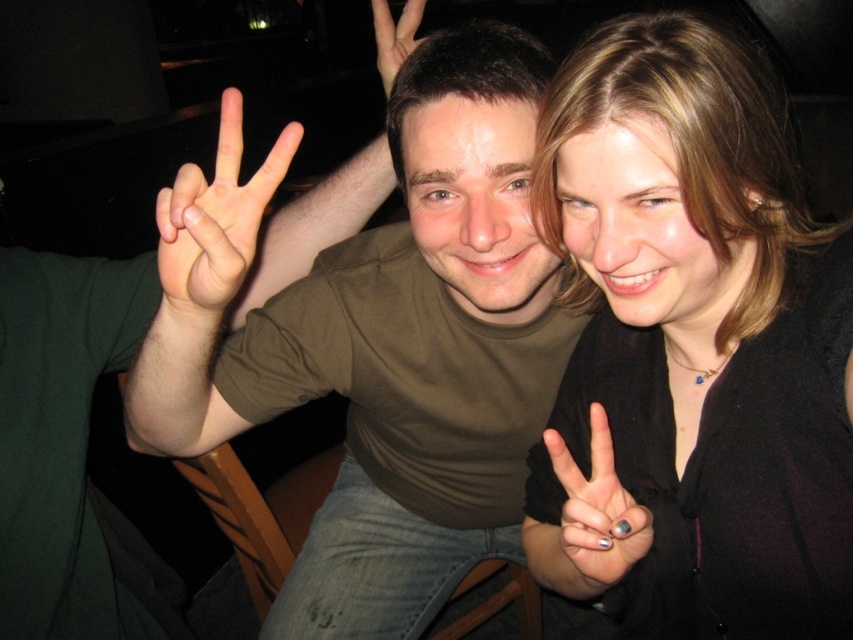
This screenshot has height=640, width=853. I want to click on matte skin hand at center, so click(218, 216).

Looking at this image, measure the distance between point (x=210, y=304) and camera.

Point (x=210, y=304) is 28.41 inches from camera.

You are a GUI agent. You are given a task and a screenshot of the screen. Output one action in this format:
    pyautogui.click(x=<x>, y=<y>)
    Task: Click on the matte skin hand at center
    The height and width of the screenshot is (640, 853).
    Given the screenshot: What is the action you would take?
    pyautogui.click(x=218, y=216)

You are a GUI agent. You are given a task and a screenshot of the screen. Output one action in this format:
    pyautogui.click(x=<x>, y=<y>)
    Task: Click on the matte black sweater at upper right
    Image resolution: width=853 pixels, height=640 pixels.
    Given the screenshot: What is the action you would take?
    pyautogui.click(x=692, y=348)

Find the location of a particular element. matte black sweater at upper right is located at coordinates (692, 348).

Is matte green shirt at center thinner than matte skin hand at center?

Incorrect, matte green shirt at center's width is not less than matte skin hand at center's.

Who is higher up, matte green shirt at center or matte skin hand at center?

matte skin hand at center is higher up.

Identify the location of matte green shirt at center. (386, 344).